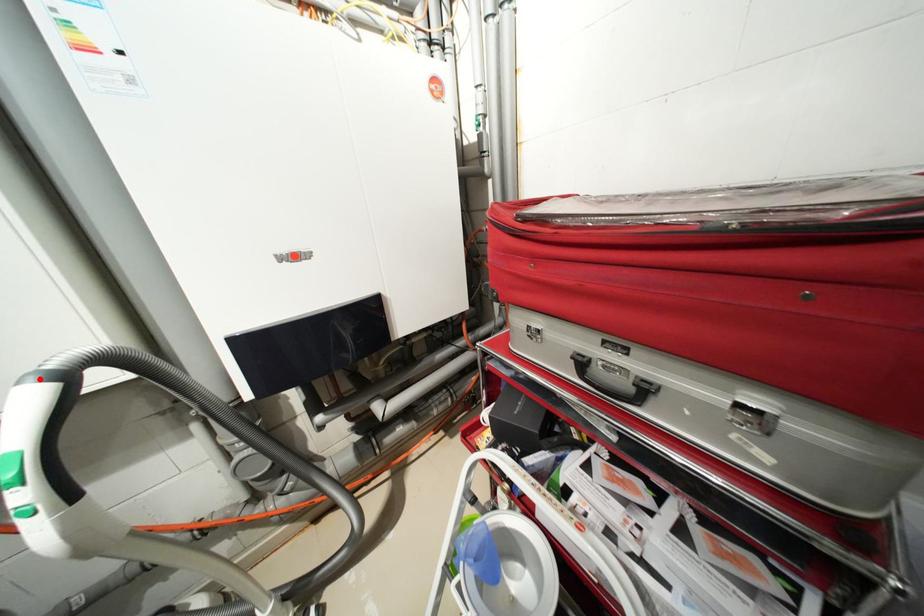
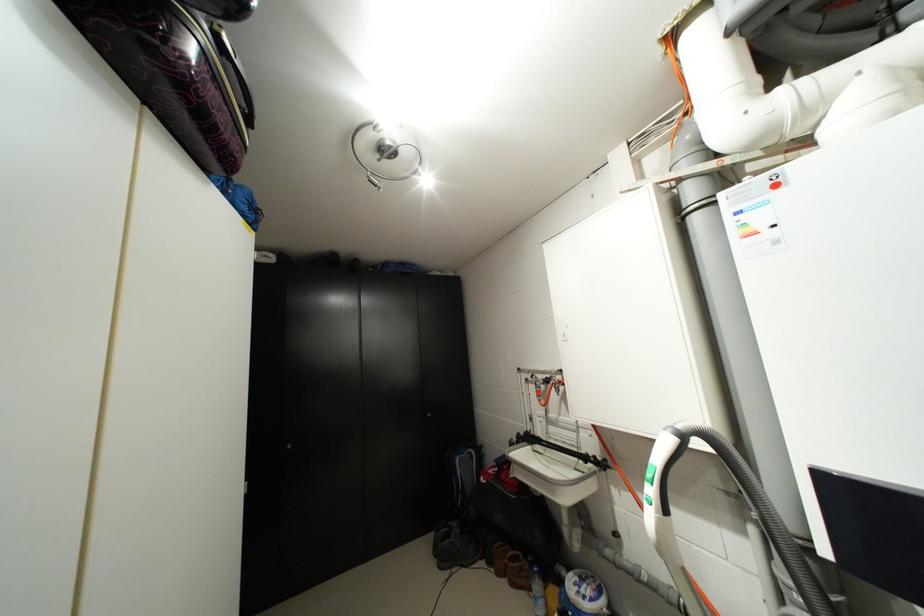
Question: A red point is marked in image1. In image2, is the corresponding 3D point closer to the camera or farther? Reply with the corresponding letter.

Choices:
 (A) The corresponding 3D point is closer.
 (B) The corresponding 3D point is farther.

Answer: (B)